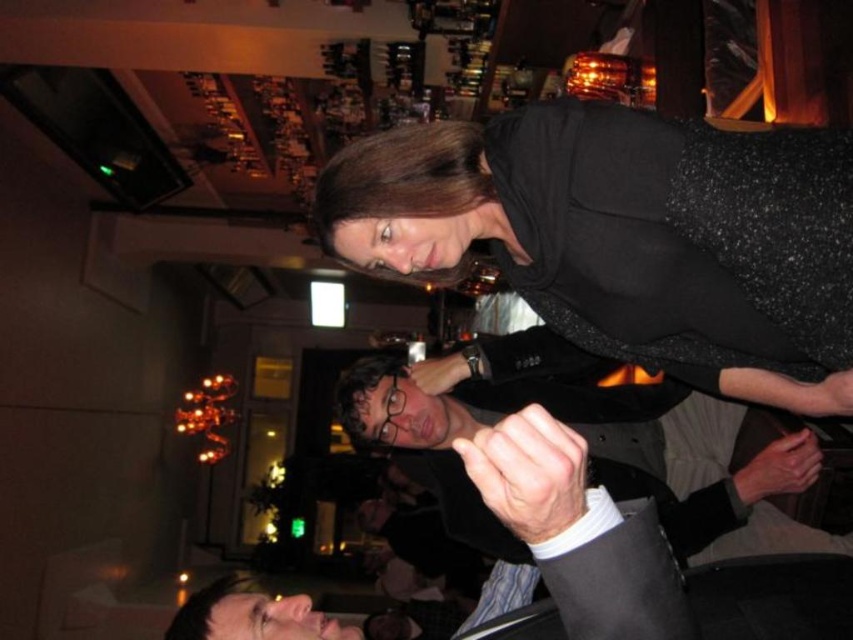
Can you confirm if black sequined dress at upper right is shorter than matte black suit at center?

Yes.

Who is more distant from viewer, (509, 170) or (672, 481)?

The point (672, 481) is more distant.

Where is `black sequined dress at upper right`? black sequined dress at upper right is located at coordinates (680, 237).